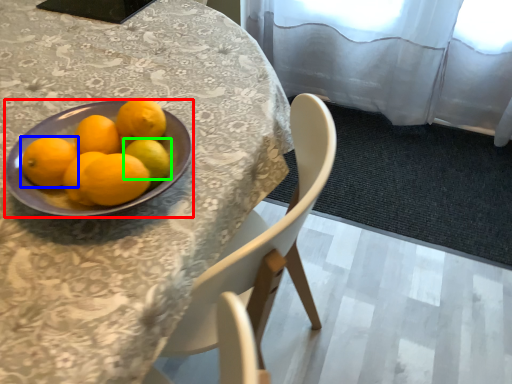
Question: Based on their relative distances, which object is farther from bowl (highlighted by a red box)? Choose from orange (highlighted by a blue box) and lemon (highlighted by a green box).

Choices:
 (A) orange
 (B) lemon

Answer: (B)